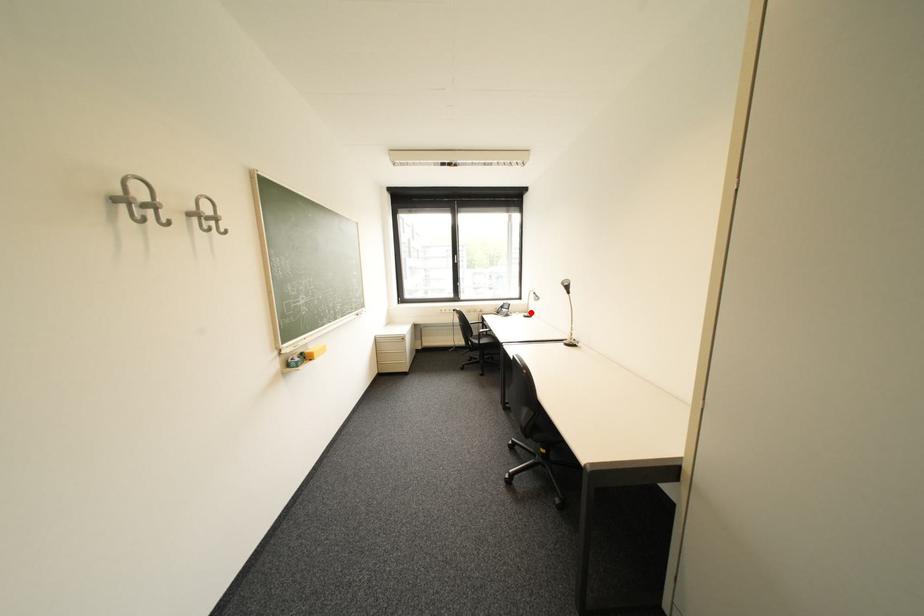
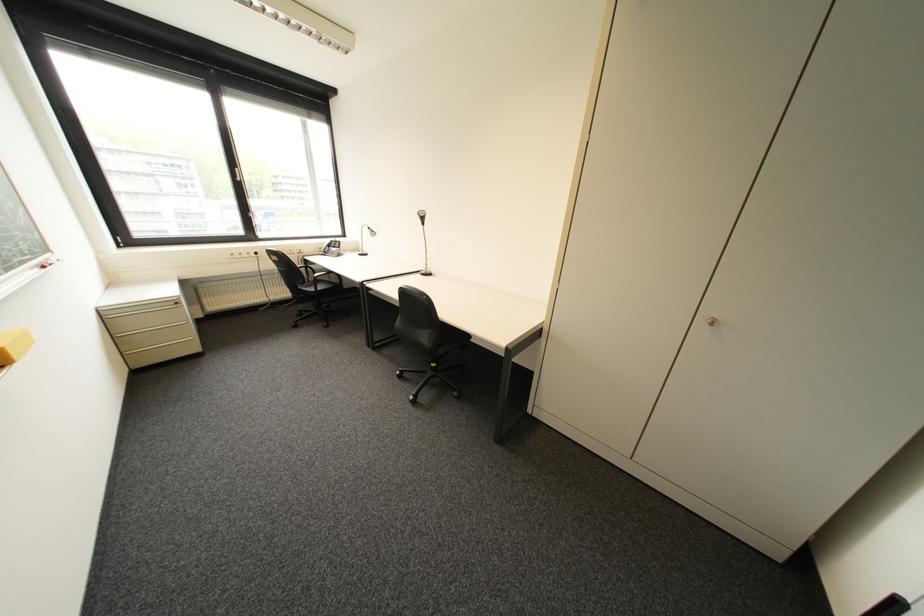
Question: I am providing you with two images of the same scene from different viewpoints. A red point is marked on the first image. Can you still see the location of the red point in image 2?

Choices:
 (A) Yes
 (B) No

Answer: (A)